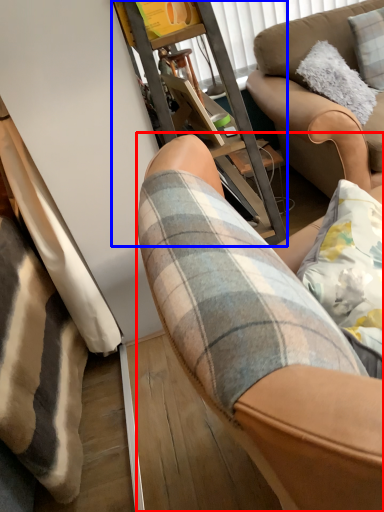
Question: Which of the following is the farthest to the observer, chair (highlighted by a red box) or furniture (highlighted by a blue box)?

Choices:
 (A) chair
 (B) furniture

Answer: (B)